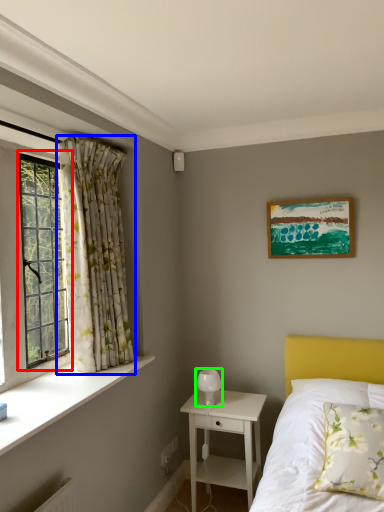
Question: Which is nearer to the window (highlighted by a red box)? curtain (highlighted by a blue box) or table lamp (highlighted by a green box).

Choices:
 (A) curtain
 (B) table lamp

Answer: (A)